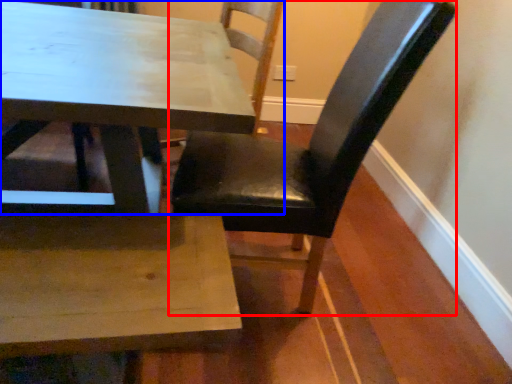
Question: Which of the following is the farthest to the observer, chair (highlighted by a red box) or chair (highlighted by a blue box)?

Choices:
 (A) chair
 (B) chair

Answer: (B)